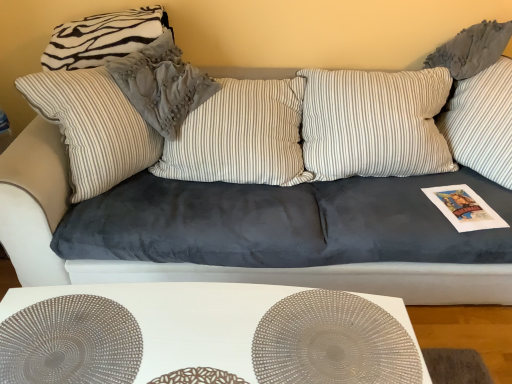
I want to click on free space above white matte table at lower center (from a real-world perspective), so click(204, 323).